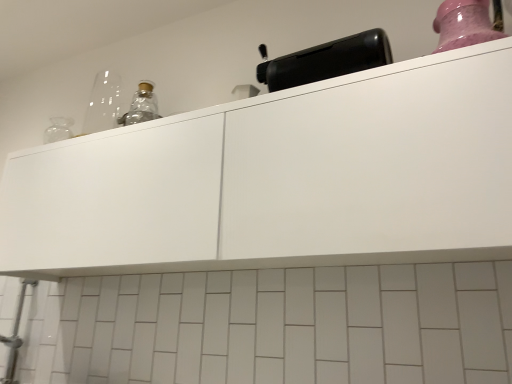
Question: From the image's perspective, does black plastic toaster at upper center appear lower than pink glossy jar at upper right?

Choices:
 (A) no
 (B) yes

Answer: (B)

Question: From a real-world perspective, does black plastic toaster at upper center stand above pink glossy jar at upper right?

Choices:
 (A) yes
 (B) no

Answer: (A)

Question: Is the depth of black plastic toaster at upper center less than that of pink glossy jar at upper right?

Choices:
 (A) yes
 (B) no

Answer: (B)

Question: Considering the relative sizes of black plastic toaster at upper center and pink glossy jar at upper right in the image provided, is black plastic toaster at upper center taller than pink glossy jar at upper right?

Choices:
 (A) yes
 (B) no

Answer: (B)

Question: Is black plastic toaster at upper center further to the viewer compared to pink glossy jar at upper right?

Choices:
 (A) yes
 (B) no

Answer: (A)

Question: From a real-world perspective, is black plastic toaster at upper center above or below pink glossy jar at upper right?

Choices:
 (A) below
 (B) above

Answer: (B)

Question: Is black plastic toaster at upper center wider or thinner than pink glossy jar at upper right?

Choices:
 (A) wide
 (B) thin

Answer: (B)

Question: Considering the positions of black plastic toaster at upper center and pink glossy jar at upper right in the image, is black plastic toaster at upper center taller or shorter than pink glossy jar at upper right?

Choices:
 (A) tall
 (B) short

Answer: (B)

Question: Would you say black plastic toaster at upper center is to the left or to the right of pink glossy jar at upper right in the picture?

Choices:
 (A) right
 (B) left

Answer: (B)

Question: Considering the positions of white matte cabinet at upper center and black plastic toaster at upper center in the image, is white matte cabinet at upper center wider or thinner than black plastic toaster at upper center?

Choices:
 (A) wide
 (B) thin

Answer: (A)

Question: Is white matte cabinet at upper center situated inside black plastic toaster at upper center or outside?

Choices:
 (A) inside
 (B) outside

Answer: (B)

Question: From the image's perspective, relative to black plastic toaster at upper center, is white matte cabinet at upper center above or below?

Choices:
 (A) above
 (B) below

Answer: (B)

Question: In the image, is white matte cabinet at upper center positioned in front of or behind black plastic toaster at upper center?

Choices:
 (A) front
 (B) behind

Answer: (A)

Question: Is pink glossy jar at upper right inside or outside of black plastic toaster at upper center?

Choices:
 (A) outside
 (B) inside

Answer: (A)

Question: Would you say pink glossy jar at upper right is to the left or to the right of black plastic toaster at upper center in the picture?

Choices:
 (A) right
 (B) left

Answer: (A)